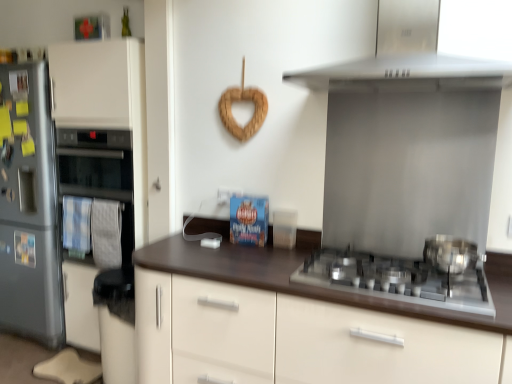
Measure the distance between polished stainless steel pot at right and camera.

polished stainless steel pot at right and camera are 5.40 feet apart.

Image resolution: width=512 pixels, height=384 pixels. Describe the element at coordinates (103, 134) in the screenshot. I see `satin white oven at left` at that location.

Identify the location of satin silver gas stove at lower right. This screenshot has height=384, width=512. (397, 280).

The image size is (512, 384). Describe the element at coordinates (302, 284) in the screenshot. I see `brown matte countertop at center` at that location.

In the scene shown: Measure the distance between point (408, 80) and camera.

A distance of 6.13 feet exists between point (408, 80) and camera.

Where is `satin silver fridge at left`? The width and height of the screenshot is (512, 384). satin silver fridge at left is located at coordinates (29, 207).

Does point (127, 164) come farther from viewer compared to point (221, 254)?

Yes, point (127, 164) is behind point (221, 254).

The width and height of the screenshot is (512, 384). Identify the location of appliance behind the brown matte countertop at center. (103, 134).

From their relative heights in the image, would you say satin white oven at left is taller or shorter than brown matte countertop at center?

Considering their sizes, satin white oven at left has more height than brown matte countertop at center.

Is satin white oven at left at the right side of brown matte countertop at center?

No, satin white oven at left is not to the right of brown matte countertop at center.

Is satin silver gas stove at lower right looking in the opposite direction of satin white oven at left?

No, satin white oven at left is not at the back of satin silver gas stove at lower right.

Would you say satin silver gas stove at lower right is outside satin white oven at left?

satin silver gas stove at lower right is positioned outside satin white oven at left.

Based on the photo, is satin silver gas stove at lower right positioned behind satin white oven at left?

No, satin silver gas stove at lower right is closer to the viewer.

Considering the relative sizes of satin silver gas stove at lower right and satin white oven at left in the image provided, is satin silver gas stove at lower right shorter than satin white oven at left?

Indeed, satin silver gas stove at lower right has a lesser height compared to satin white oven at left.

Where is `home appliance above the satin silver fridge at left (from the image's perspective)`? Image resolution: width=512 pixels, height=384 pixels. home appliance above the satin silver fridge at left (from the image's perspective) is located at coordinates (409, 73).

Is stainless steel range hood at upper center inside or outside of satin silver fridge at left?

stainless steel range hood at upper center is outside satin silver fridge at left.

From a real-world perspective, which is physically above, stainless steel range hood at upper center or satin silver fridge at left?

stainless steel range hood at upper center.

Considering the points (362, 64) and (8, 118), which point is behind, point (362, 64) or point (8, 118)?

The point (8, 118) is farther.

Is the depth of stainless steel range hood at upper center less than that of satin silver gas stove at lower right?

Yes, stainless steel range hood at upper center is closer to the camera.

Do you think stainless steel range hood at upper center is within satin silver gas stove at lower right, or outside of it?

stainless steel range hood at upper center cannot be found inside satin silver gas stove at lower right.

Who is smaller, stainless steel range hood at upper center or satin silver gas stove at lower right?

With smaller size is satin silver gas stove at lower right.

From the image's perspective, is satin white oven at left located above polished stainless steel pot at right?

Yes.

From a real-world perspective, is satin white oven at left located beneath polished stainless steel pot at right?

No, from a real-world perspective, satin white oven at left is not under polished stainless steel pot at right.

Would you say satin white oven at left is outside polished stainless steel pot at right?

Yes, satin white oven at left is located beyond the bounds of polished stainless steel pot at right.

Between satin silver fridge at left and stainless steel range hood at upper center, which one has smaller width?

Thinner between the two is stainless steel range hood at upper center.

Is satin silver fridge at left facing towards stainless steel range hood at upper center?

No, satin silver fridge at left is not turned towards stainless steel range hood at upper center.

Who is shorter, satin silver fridge at left or stainless steel range hood at upper center?

Standing shorter between the two is stainless steel range hood at upper center.

From a real-world perspective, who is located higher, satin silver fridge at left or stainless steel range hood at upper center?

stainless steel range hood at upper center is physically above.

Is polished stainless steel pot at right to the right of stainless steel range hood at upper center from the viewer's perspective?

Correct, you'll find polished stainless steel pot at right to the right of stainless steel range hood at upper center.

Is polished stainless steel pot at right wider than stainless steel range hood at upper center?

No, polished stainless steel pot at right is not wider than stainless steel range hood at upper center.

Which is behind, point (441, 247) or point (508, 23)?

The point (508, 23) is more distant.

You are a GUI agent. You are given a task and a screenshot of the screen. Output one action in this format:
    pyautogui.click(x=<x>, y=<y>)
    Task: Click on the countertop on the right of satin white oven at left
    
    Given the screenshot: What is the action you would take?
    pyautogui.click(x=302, y=284)

The width and height of the screenshot is (512, 384). Find the location of `gas stove that appears below the satin white oven at left (from a real-world perspective)`. gas stove that appears below the satin white oven at left (from a real-world perspective) is located at coordinates pyautogui.click(x=397, y=280).

From the image, which object appears to be farther from polished stainless steel pot at right, satin silver gas stove at lower right or satin white oven at left?

satin white oven at left.

Looking at the image, which one is located further to satin silver fridge at left, brown matte countertop at center or stainless steel range hood at upper center?

Based on the image, stainless steel range hood at upper center appears to be further to satin silver fridge at left.

Consider the image. Estimate the real-world distances between objects in this image. Which object is closer to polished stainless steel pot at right, satin silver gas stove at lower right or satin silver fridge at left?

Among the two, satin silver gas stove at lower right is located nearer to polished stainless steel pot at right.

Which object lies further to the anchor point polished stainless steel pot at right, satin silver fridge at left or stainless steel range hood at upper center?

satin silver fridge at left is positioned further to the anchor polished stainless steel pot at right.

Looking at the image, which one is located further to satin silver gas stove at lower right, satin silver fridge at left or brown matte countertop at center?

satin silver fridge at left lies further to satin silver gas stove at lower right than the other object.

Which object lies further to the anchor point brown matte countertop at center, satin silver fridge at left or stainless steel range hood at upper center?

satin silver fridge at left lies further to brown matte countertop at center than the other object.

Based on their spatial positions, is polished stainless steel pot at right or satin silver gas stove at lower right further from brown matte countertop at center?

Among the two, polished stainless steel pot at right is located further to brown matte countertop at center.

From the picture: Looking at the image, which one is located closer to brown matte countertop at center, polished stainless steel pot at right or satin silver fridge at left?

polished stainless steel pot at right lies closer to brown matte countertop at center than the other object.

Where is `appliance situated between satin silver fridge at left and stainless steel range hood at upper center from left to right`? The width and height of the screenshot is (512, 384). appliance situated between satin silver fridge at left and stainless steel range hood at upper center from left to right is located at coordinates coord(103,134).

Image resolution: width=512 pixels, height=384 pixels. Find the location of `gas stove between stainless steel range hood at upper center and brown matte countertop at center from top to bottom`. gas stove between stainless steel range hood at upper center and brown matte countertop at center from top to bottom is located at coordinates (397, 280).

At what (x,y) coordinates should I click in order to perform the action: click on appliance situated between satin silver fridge at left and brown matte countertop at center from left to right. Please return your answer as a coordinate pair (x, y). Looking at the image, I should click on (103, 134).

At what (x,y) coordinates should I click in order to perform the action: click on countertop situated between satin silver fridge at left and polished stainless steel pot at right from left to right. Please return your answer as a coordinate pair (x, y). The image size is (512, 384). Looking at the image, I should click on (302, 284).